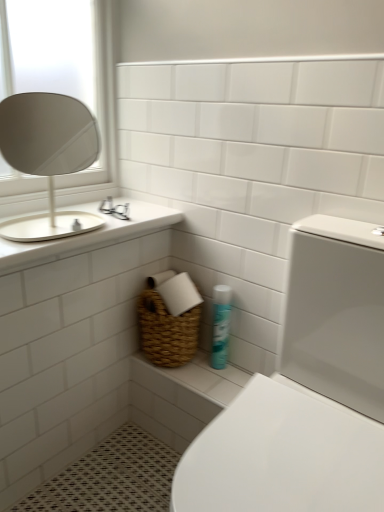
The height and width of the screenshot is (512, 384). In order to click on space that is in front of blue glossy spray can at lower center in this screenshot , I will do click(x=218, y=381).